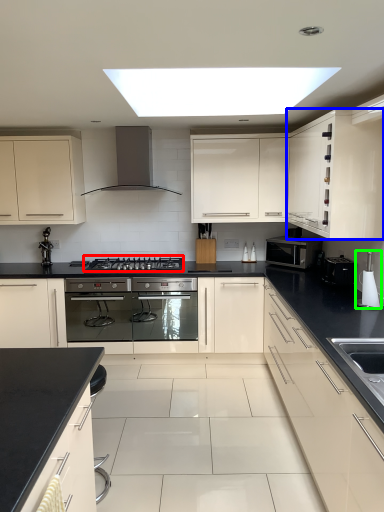
Question: Considering the real-world distances, which object is farthest from gas stove (highlighted by a red box)? cabinetry (highlighted by a blue box) or appliance (highlighted by a green box)?

Choices:
 (A) cabinetry
 (B) appliance

Answer: (B)